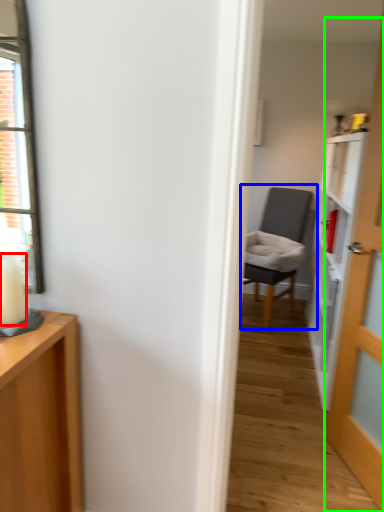
Question: Which is farther away from candle (highlighted by a red box)? chair (highlighted by a blue box) or door (highlighted by a green box)?

Choices:
 (A) chair
 (B) door

Answer: (A)